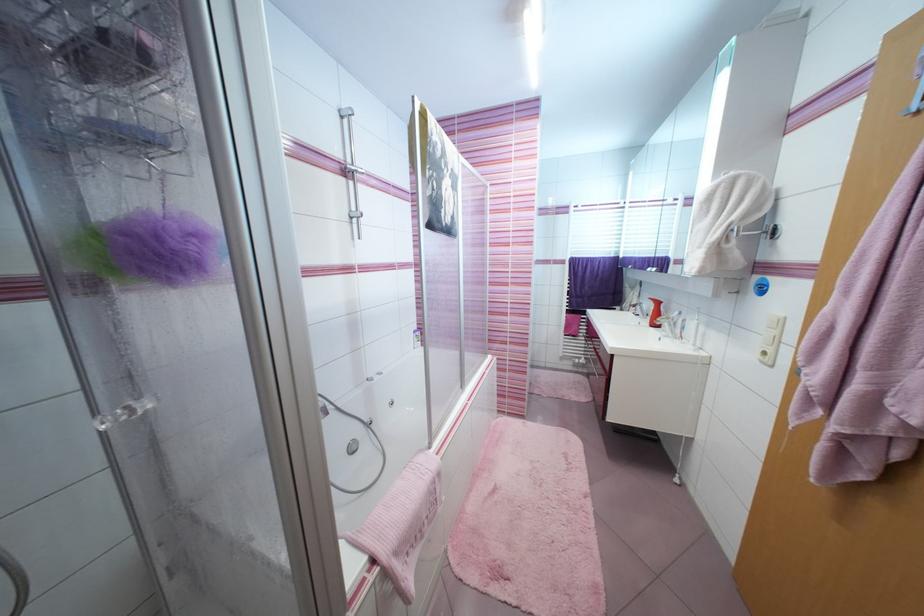
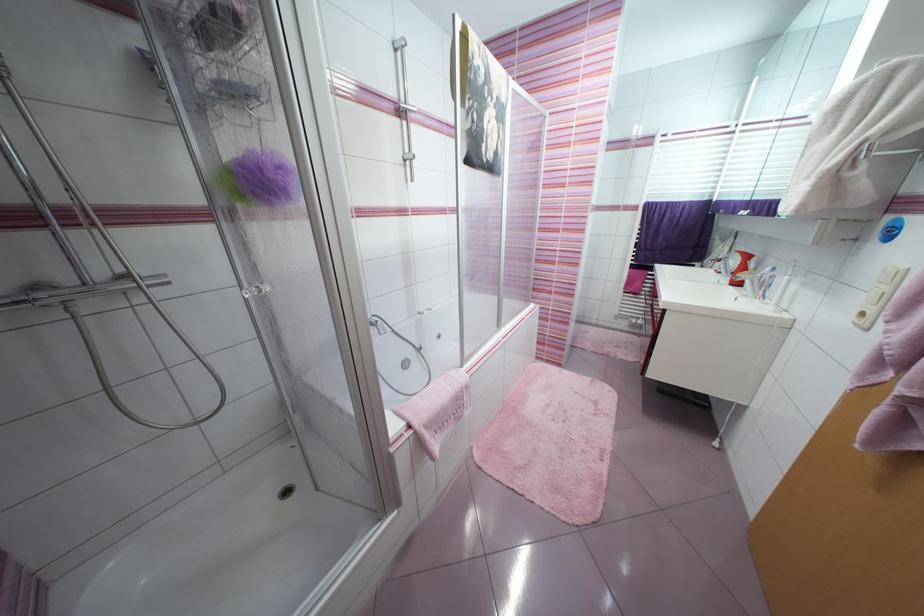
Question: The images are taken continuously from a first-person perspective. In which direction is your viewpoint rotating?

Choices:
 (A) Left
 (B) Right
 (C) Up
 (D) Down

Answer: (A)